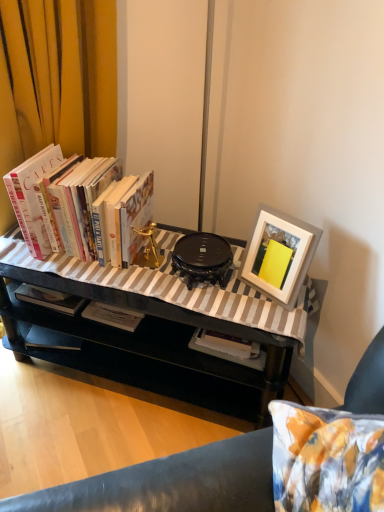
Question: Visually, is black glossy table at center positioned to the left or to the right of white matte picture frame at upper right?

Choices:
 (A) right
 (B) left

Answer: (B)

Question: Is black glossy table at center in front of or behind white matte picture frame at upper right in the image?

Choices:
 (A) front
 (B) behind

Answer: (A)

Question: Which object is positioned farthest from the hardcover books at left?

Choices:
 (A) black glossy table at center
 (B) white matte picture frame at upper right

Answer: (B)

Question: Based on their relative distances, which object is farther from the black glossy table at center?

Choices:
 (A) white matte picture frame at upper right
 (B) hardcover books at left

Answer: (A)